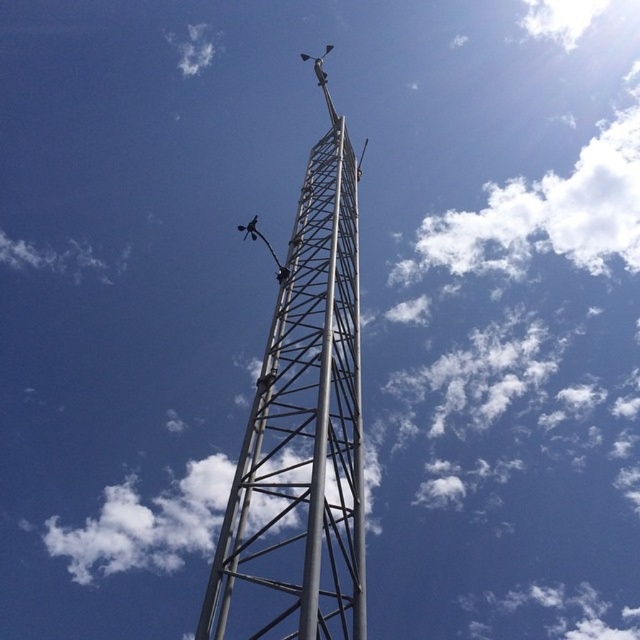
Is silver metallic tower at center below white fluffy cloud at upper center?

Correct, silver metallic tower at center is located below white fluffy cloud at upper center.

Is silver metallic tower at center to the left of white fluffy cloud at upper center from the viewer's perspective?

No, silver metallic tower at center is not to the left of white fluffy cloud at upper center.

What do you see at coordinates (301, 433) in the screenshot? I see `silver metallic tower at center` at bounding box center [301, 433].

This screenshot has width=640, height=640. I want to click on silver metallic tower at center, so [301, 433].